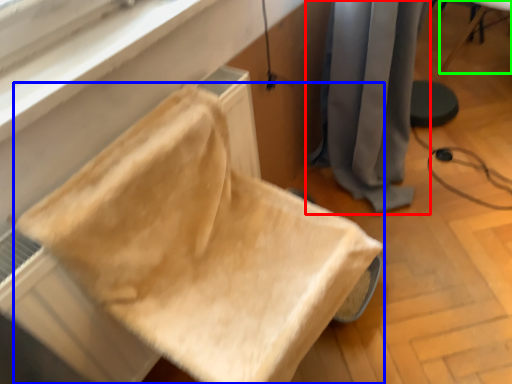
Question: Based on their relative distances, which object is farther from curtain (highlighted by a red box)? Choose from furniture (highlighted by a blue box) and furniture (highlighted by a green box).

Choices:
 (A) furniture
 (B) furniture

Answer: (B)